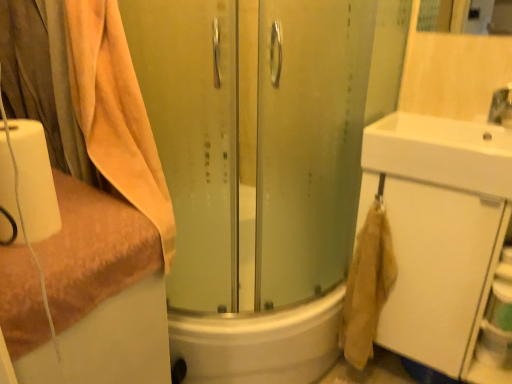
Question: Considering the relative sizes of white matte toilet paper at left and beige cotton towel at lower right in the image provided, is white matte toilet paper at left taller than beige cotton towel at lower right?

Choices:
 (A) no
 (B) yes

Answer: (A)

Question: Are white matte toilet paper at left and beige cotton towel at lower right beside each other?

Choices:
 (A) no
 (B) yes

Answer: (A)

Question: From a real-world perspective, is white matte toilet paper at left beneath beige cotton towel at lower right?

Choices:
 (A) yes
 (B) no

Answer: (B)

Question: Considering the relative sizes of white matte toilet paper at left and beige cotton towel at lower right in the image provided, is white matte toilet paper at left thinner than beige cotton towel at lower right?

Choices:
 (A) yes
 (B) no

Answer: (B)

Question: Would you say white matte toilet paper at left is a long distance from beige cotton towel at lower right?

Choices:
 (A) yes
 (B) no

Answer: (B)

Question: Looking at the image, does beige cotton towel at lower right seem bigger or smaller compared to white glossy sink at upper right?

Choices:
 (A) big
 (B) small

Answer: (B)

Question: In the image, is beige cotton towel at lower right on the left side or the right side of white glossy sink at upper right?

Choices:
 (A) right
 (B) left

Answer: (B)

Question: In terms of height, does beige cotton towel at lower right look taller or shorter compared to white glossy sink at upper right?

Choices:
 (A) short
 (B) tall

Answer: (B)

Question: Considering the positions of point (352, 345) and point (414, 165), is point (352, 345) closer or farther from the camera than point (414, 165)?

Choices:
 (A) closer
 (B) farther

Answer: (B)

Question: In terms of size, does white matte cabinet at right appear bigger or smaller than orange terry cloth towel at left, the second towel viewed from the top?

Choices:
 (A) big
 (B) small

Answer: (B)

Question: From the image's perspective, is white matte cabinet at right positioned above or below orange terry cloth towel at left, the 1th towel positioned from the bottom?

Choices:
 (A) above
 (B) below

Answer: (A)

Question: Is point (472, 379) positioned closer to the camera than point (96, 289)?

Choices:
 (A) closer
 (B) farther

Answer: (B)

Question: Considering their positions, is white matte cabinet at right located in front of or behind orange terry cloth towel at left, the 1th towel positioned from the bottom?

Choices:
 (A) behind
 (B) front

Answer: (A)

Question: Looking at their shapes, would you say orange terry cloth towel at left, the 1th towel positioned from the bottom, is wider or thinner than white matte toilet paper at left?

Choices:
 (A) wide
 (B) thin

Answer: (A)

Question: Looking at the image, does orange terry cloth towel at left, the 1th towel positioned from the bottom, seem bigger or smaller compared to white matte toilet paper at left?

Choices:
 (A) small
 (B) big

Answer: (B)